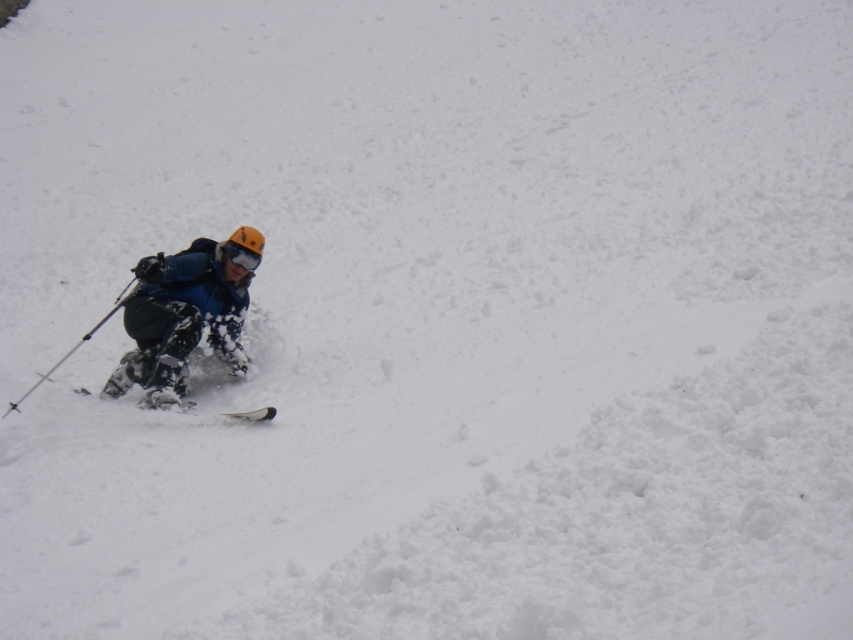
Question: Can you confirm if matte black ski pole at left is thinner than white matte ski at lower left?

Choices:
 (A) no
 (B) yes

Answer: (B)

Question: Among these objects, which one is farthest from the camera?

Choices:
 (A) matte black ski pole at left
 (B) matte blue ski suit at center-left
 (C) white matte ski at lower left

Answer: (A)

Question: Is matte blue ski suit at center-left wider than white matte ski at lower left?

Choices:
 (A) yes
 (B) no

Answer: (A)

Question: Which of the following is the closest to the observer?

Choices:
 (A) white matte ski at lower left
 (B) matte black ski pole at left
 (C) matte blue ski suit at center-left

Answer: (C)

Question: Among these objects, which one is farthest from the camera?

Choices:
 (A) matte blue ski suit at center-left
 (B) white matte ski at lower left

Answer: (B)

Question: Does matte black ski pole at left lie behind white matte ski at lower left?

Choices:
 (A) yes
 (B) no

Answer: (A)